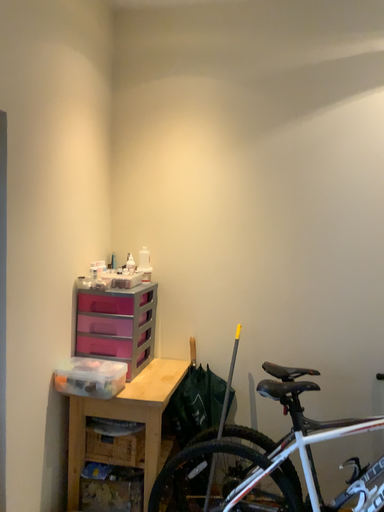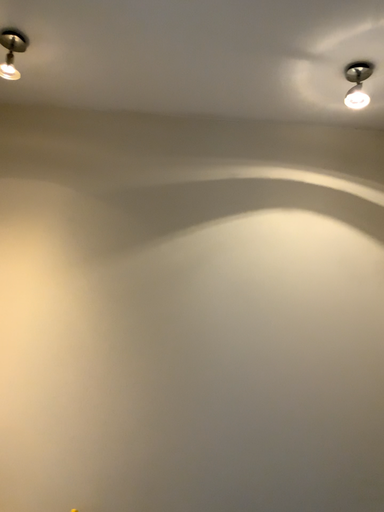
Question: How did the camera likely rotate when shooting the video?

Choices:
 (A) rotated right
 (B) rotated left

Answer: (A)